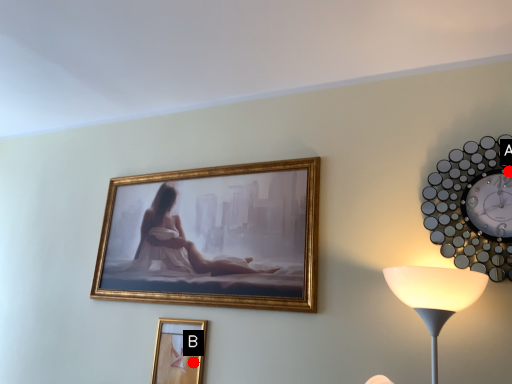
Question: Two points are circled on the image, labeled by A and B beside each circle. Which point is closer to the camera?

Choices:
 (A) A is closer
 (B) B is closer

Answer: (A)